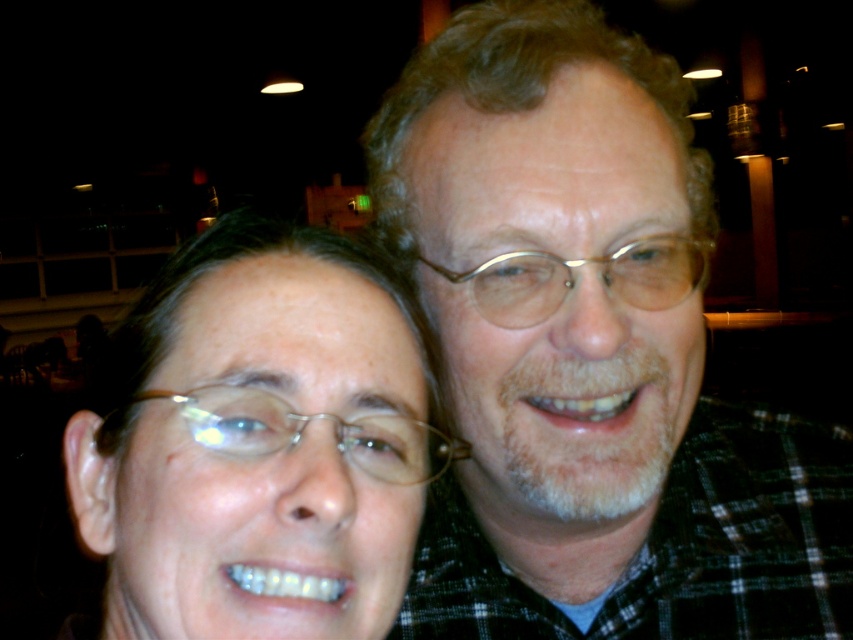
You are taking a photo with two people standing close together. You notice a plaid shirt at center and metallic gold glasses at center. How far apart are these two items?

The plaid shirt at center and metallic gold glasses at center are 10.09 centimeters apart from each other.

You are trying to determine which object is wider between the plaid shirt at center and the metallic silver glasses at center in the image. Based on the scene description, which one is wider?

The plaid shirt at center is wider than the metallic silver glasses at center according to the description.